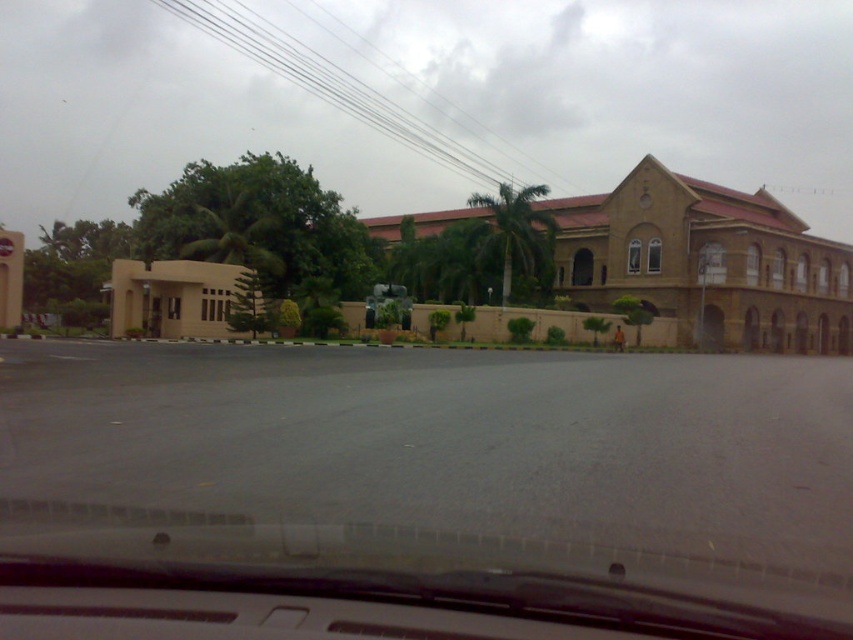
Question: Does transparent glass windshield at center appear over brown stone church at center?

Choices:
 (A) no
 (B) yes

Answer: (A)

Question: Estimate the real-world distances between objects in this image. Which object is farther from the transparent glass windshield at center?

Choices:
 (A) beige matte building at left
 (B) brown stone church at center

Answer: (B)

Question: Which object is closer to the camera taking this photo?

Choices:
 (A) beige matte building at left
 (B) transparent glass windshield at center
 (C) brown stone church at center

Answer: (B)

Question: Does transparent glass windshield at center come behind brown stone church at center?

Choices:
 (A) yes
 (B) no

Answer: (B)

Question: Which object appears farthest from the camera in this image?

Choices:
 (A) brown stone church at center
 (B) transparent glass windshield at center
 (C) beige matte building at left

Answer: (A)

Question: Does transparent glass windshield at center appear on the right side of brown stone church at center?

Choices:
 (A) yes
 (B) no

Answer: (B)